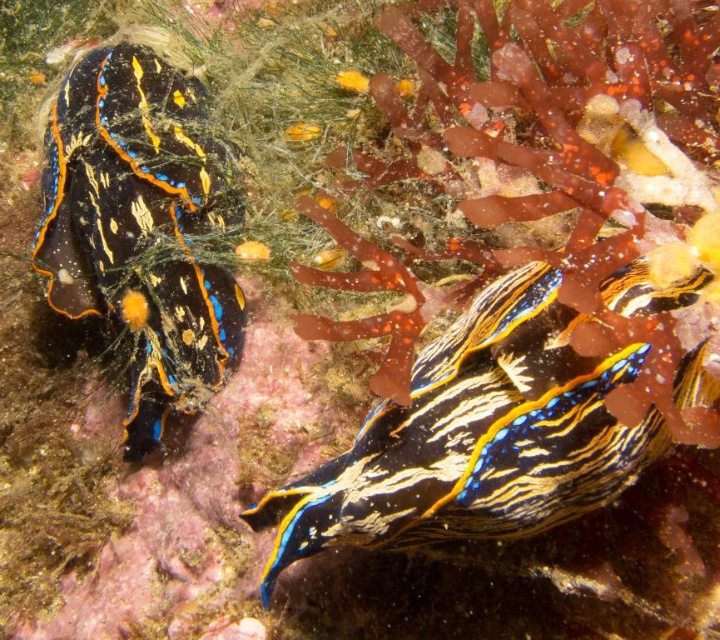
Question: Which of the following is the farthest from the observer?

Choices:
 (A) (566, 412)
 (B) (86, 147)

Answer: (B)

Question: Which object appears closest to the camera in this image?

Choices:
 (A) shiny black and blue shell at left
 (B) shiny blue and yellow striped sea slug at center

Answer: (B)

Question: Does shiny blue and yellow striped sea slug at center appear on the left side of shiny black and blue shell at left?

Choices:
 (A) no
 (B) yes

Answer: (A)

Question: Does shiny blue and yellow striped sea slug at center appear under shiny black and blue shell at left?

Choices:
 (A) yes
 (B) no

Answer: (A)

Question: Is shiny blue and yellow striped sea slug at center further to the viewer compared to shiny black and blue shell at left?

Choices:
 (A) yes
 (B) no

Answer: (B)